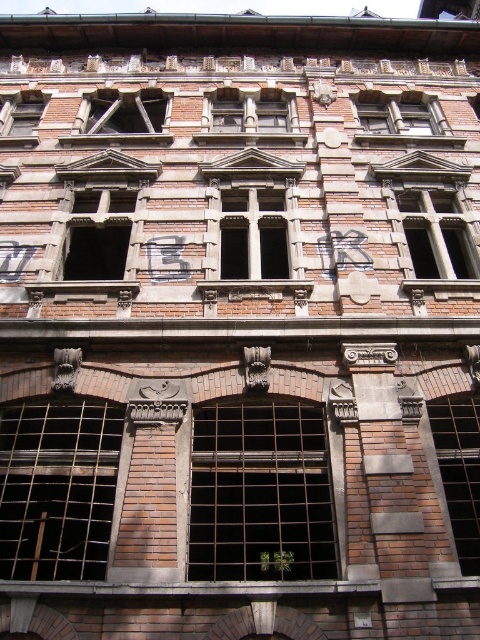
You are standing at the base of the multi story building and want to take a photo of the rusty metal window at center. If your camera has a maximum focus range of 30 meters, will you be able to capture the window clearly?

The rusty metal window at center is 30.92 meters away from the camera. Since the camera can only focus up to 30 meters, it won t be able to capture the window clearly.

You are an architect examining the building facade. You notice a point labeled at coordinates (x=58, y=488). What object is located at this point?

The point at coordinates (x=58, y=488) indicates rusty metal bars at lower left.

From the picture: You are standing in front of the building and want to take a photo. You notice two points on the building marked as point 1 at coordinate (278, 403) and point 2 at coordinate (427, 108). Which point will appear larger in your camera view?

Point 1 at coordinate (278, 403) will appear larger in the camera view because it is closer to the camera than point 2 at coordinate (427, 108).